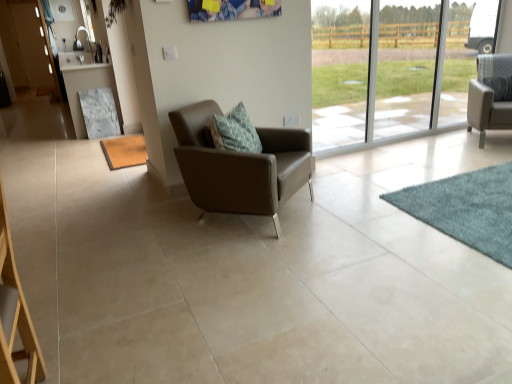
The height and width of the screenshot is (384, 512). Identify the location of vacant region under transparent glass window at right (from a real-world perspective). (386, 141).